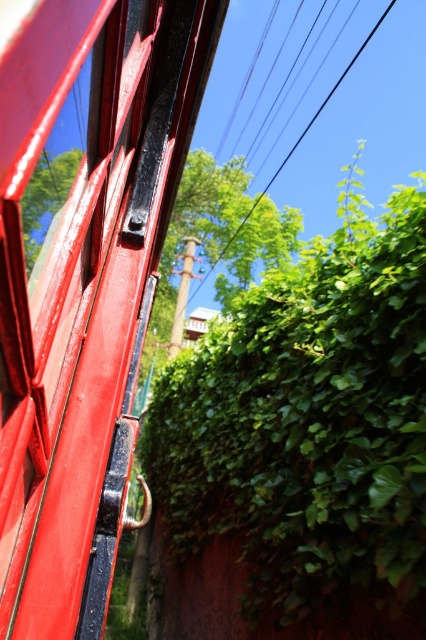
Question: Is shiny red metal train window at left closer to camera compared to green leafy tree at upper center?

Choices:
 (A) yes
 (B) no

Answer: (A)

Question: Based on their relative distances, which object is nearer to the green leafy tree at upper center?

Choices:
 (A) shiny red metal train window at left
 (B) green leafy tree at center

Answer: (A)

Question: Does green leafy tree at center have a smaller size compared to green leafy tree at upper center?

Choices:
 (A) yes
 (B) no

Answer: (B)

Question: Does green leafy tree at center have a larger size compared to green leafy tree at upper center?

Choices:
 (A) no
 (B) yes

Answer: (B)

Question: Which of the following is the closest to the observer?

Choices:
 (A) (71, 136)
 (B) (221, 216)
 (C) (282, 541)
 (D) (31, 202)

Answer: (D)

Question: Which object is positioned farthest from the green leafy hedge at center?

Choices:
 (A) shiny red metal train window at left
 (B) green leafy tree at upper center

Answer: (B)